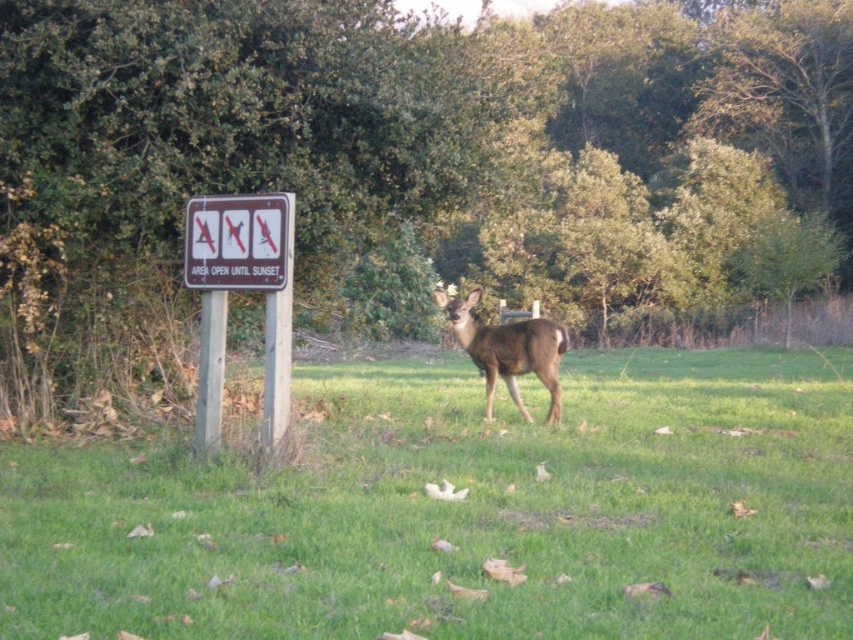
Is green grass at center taller than brown wooden sign at left?

Incorrect, green grass at center's height is not larger of brown wooden sign at left's.

Does point (482, 586) come closer to viewer compared to point (286, 381)?

Yes, point (482, 586) is in front of point (286, 381).

Find the location of a particular element. The image size is (853, 640). green grass at center is located at coordinates (463, 513).

I want to click on green grass at center, so click(463, 513).

Is metallic rectangular sign at center behind brown matte deer at center?

No, it is not.

Is point (234, 216) in front of point (479, 349)?

That is True.

Is point (198, 273) less distant than point (514, 352)?

Yes, it is in front of point (514, 352).

Locate an element on the screen. The width and height of the screenshot is (853, 640). metallic rectangular sign at center is located at coordinates (236, 243).

Does point (251, 275) come closer to viewer compared to point (195, 275)?

Yes, point (251, 275) is in front of point (195, 275).

Does brown wooden sign at left have a greater width compared to metallic rectangular sign at center?

Yes.

Find the location of `brown wooden sign at left`. brown wooden sign at left is located at coordinates (241, 289).